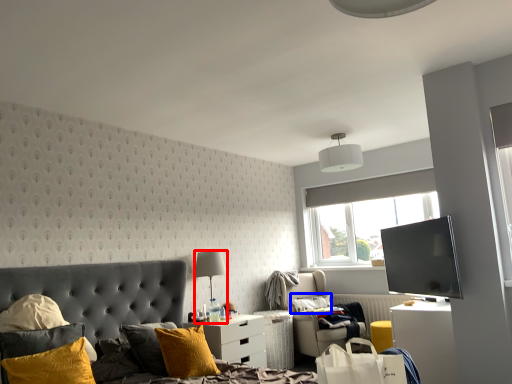
Question: Which object appears closest to the camera in this image, lamp (highlighted by a red box) or pillow (highlighted by a blue box)?

Choices:
 (A) lamp
 (B) pillow

Answer: (A)